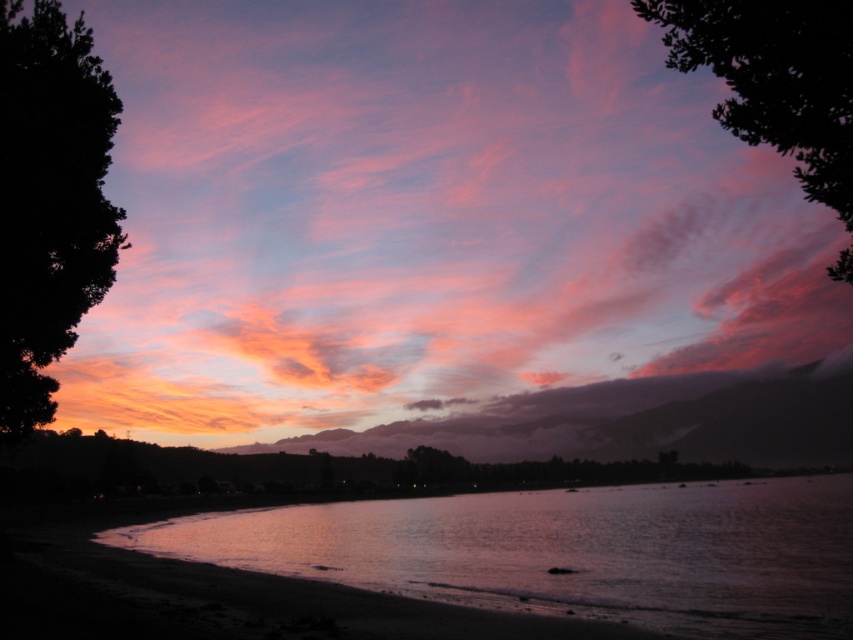
Who is shorter, pink glossy water at lower left or silhouette tree at left?

pink glossy water at lower left is shorter.

Between pink glossy water at lower left and silhouette tree at left, which one appears on the left side from the viewer's perspective?

silhouette tree at left

Measure the distance between pink glossy water at lower left and camera.

pink glossy water at lower left and camera are 19.50 meters apart.

Locate an element on the screen. pink glossy water at lower left is located at coordinates (567, 552).

Between silhouette tree at left and dark green leafy tree at upper right, which one has less height?

silhouette tree at left is shorter.

Who is more forward, (7, 244) or (782, 109)?

Positioned in front is point (782, 109).

What are the coordinates of `silhouette tree at left` in the screenshot? It's located at (49, 200).

Is point (843, 621) positioned before point (647, 6)?

No, it is not.

Does pink glossy water at lower left have a smaller size compared to dark green leafy tree at upper right?

Yes.

Describe the element at coordinates (567, 552) in the screenshot. I see `pink glossy water at lower left` at that location.

This screenshot has height=640, width=853. In order to click on pink glossy water at lower left in this screenshot , I will do `click(567, 552)`.